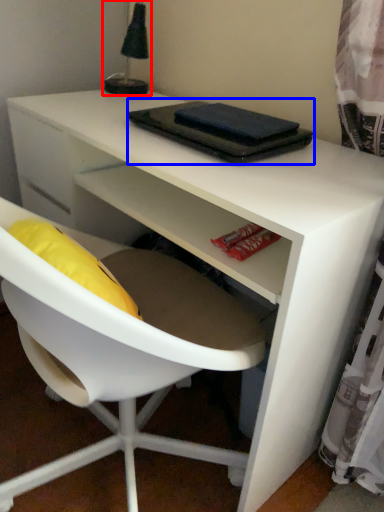
Question: Which object appears closest to the camera in this image, table lamp (highlighted by a red box) or notebook (highlighted by a blue box)?

Choices:
 (A) table lamp
 (B) notebook

Answer: (B)